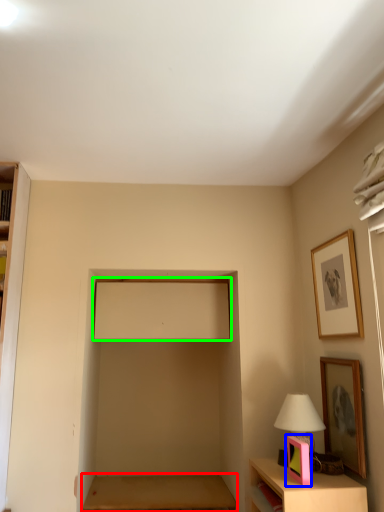
Question: Estimate the real-world distances between objects in this image. Which object is closer to table (highlighted by a red box), picture frame (highlighted by a blue box) or window screen (highlighted by a green box)?

Choices:
 (A) picture frame
 (B) window screen

Answer: (B)